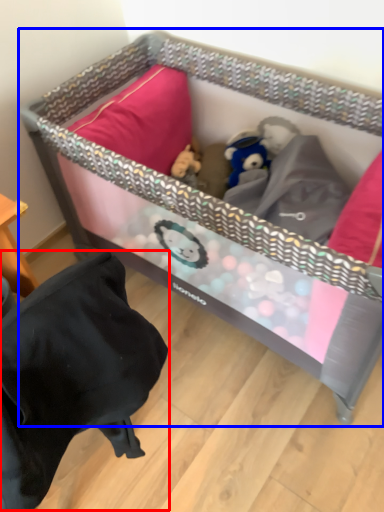
Question: Which of the following is the farthest to the observer, bean bag chair (highlighted by a red box) or infant bed (highlighted by a blue box)?

Choices:
 (A) bean bag chair
 (B) infant bed

Answer: (B)